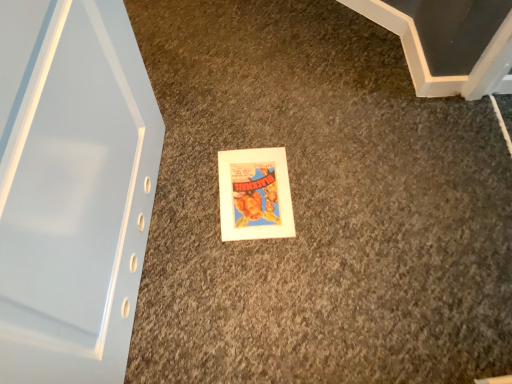
I want to click on unoccupied space behind white glossy door at left, so click(x=213, y=115).